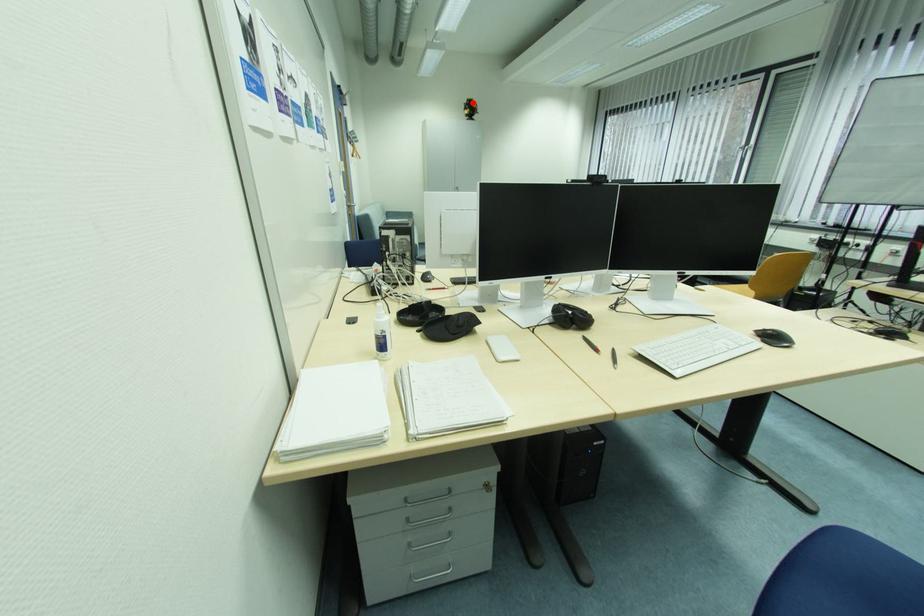
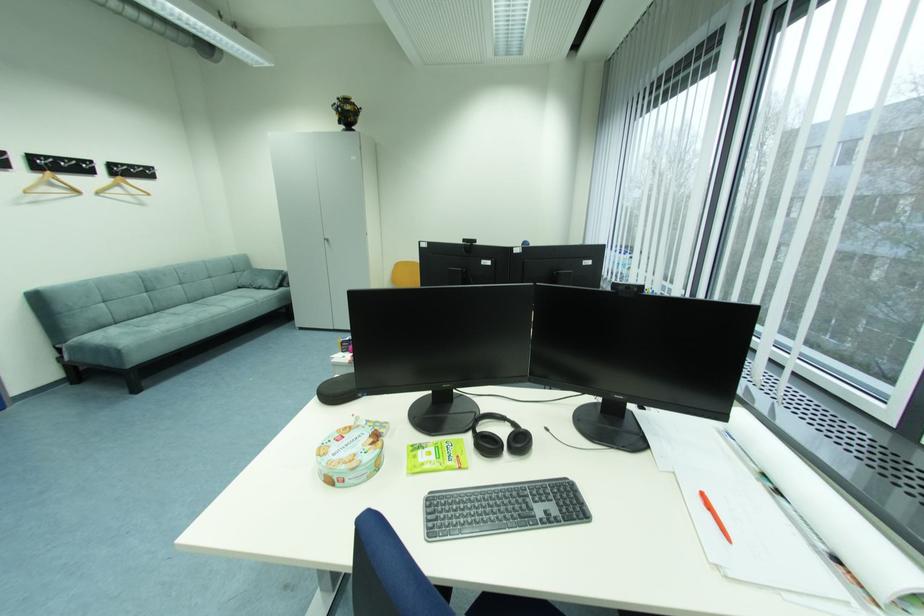
The point at the highlighted location is marked in the first image. Where is the corresponding point in the second image?

(344, 103)